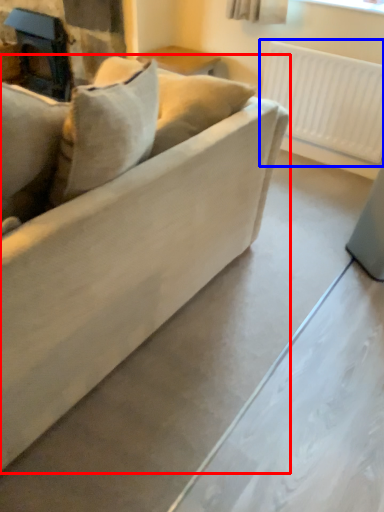
Question: Among these objects, which one is nearest to the camera, studio couch (highlighted by a red box) or radiator (highlighted by a blue box)?

Choices:
 (A) studio couch
 (B) radiator

Answer: (A)